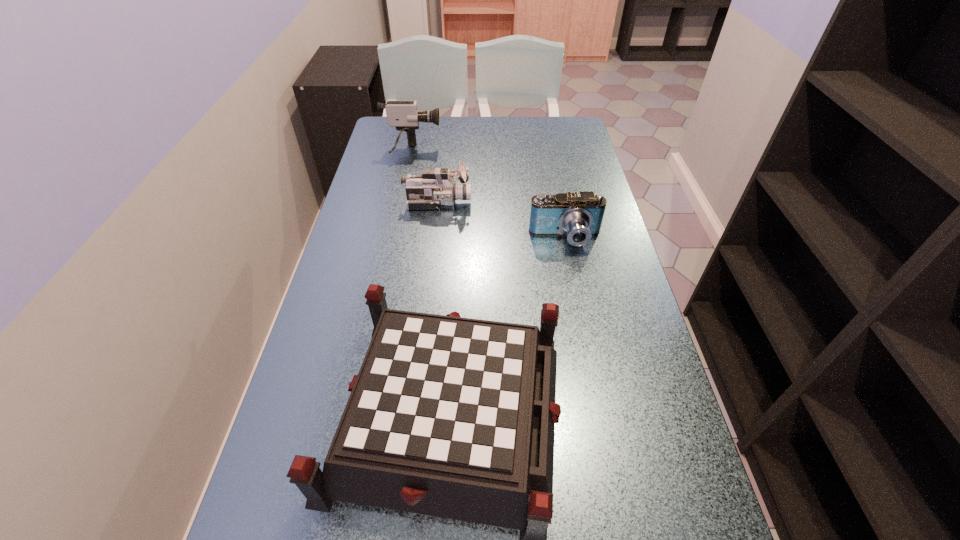
Locate an element on the screen. Image resolution: width=960 pixels, height=540 pixels. the farthest camcorder is located at coordinates (404, 115).

Identify the location of the farthest object. (404, 115).

The height and width of the screenshot is (540, 960). I want to click on the second farthest object, so click(436, 187).

This screenshot has width=960, height=540. I want to click on the nearest camcorder, so click(x=579, y=215).

The width and height of the screenshot is (960, 540). I want to click on the rightmost camcorder, so click(x=579, y=215).

Locate an element on the screen. This screenshot has width=960, height=540. free space located 0.270m on the recording direction of the tallest camcorder is located at coordinates (516, 152).

The height and width of the screenshot is (540, 960). What are the coordinates of `blank area located on the front-facing side of the third nearest object` in the screenshot? It's located at (546, 202).

Image resolution: width=960 pixels, height=540 pixels. I want to click on free space located on the front-facing side of the third farthest object, so click(576, 292).

Identify the location of object that is at the far edge. The height and width of the screenshot is (540, 960). (404, 115).

Locate an element on the screen. object at the right edge is located at coordinates (579, 215).